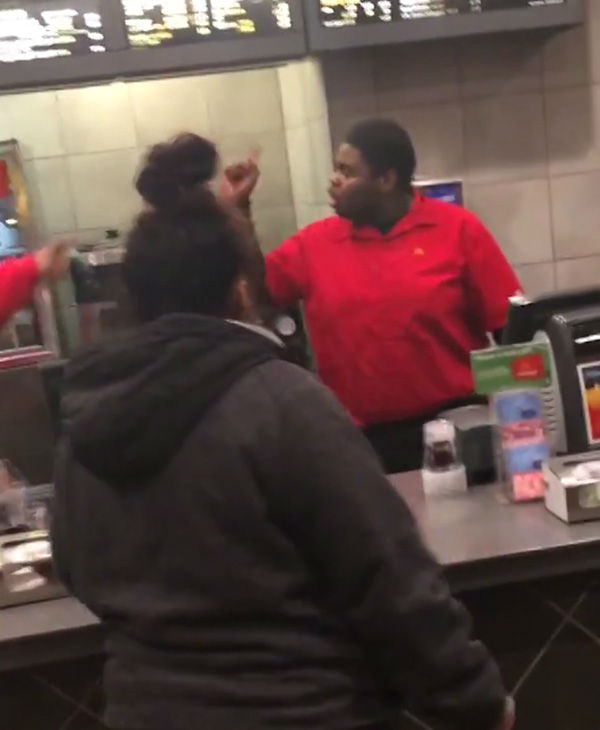
The width and height of the screenshot is (600, 730). In order to click on napkins in this screenshot , I will do `click(585, 469)`, `click(37, 547)`.